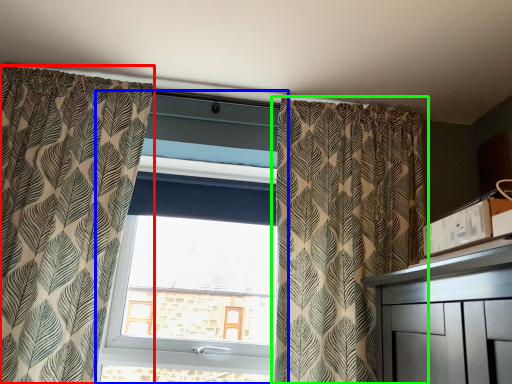
Question: Which object is the closest to the curtain (highlighted by a red box)? Choose among these: window (highlighted by a blue box) or curtain (highlighted by a green box).

Choices:
 (A) window
 (B) curtain

Answer: (A)